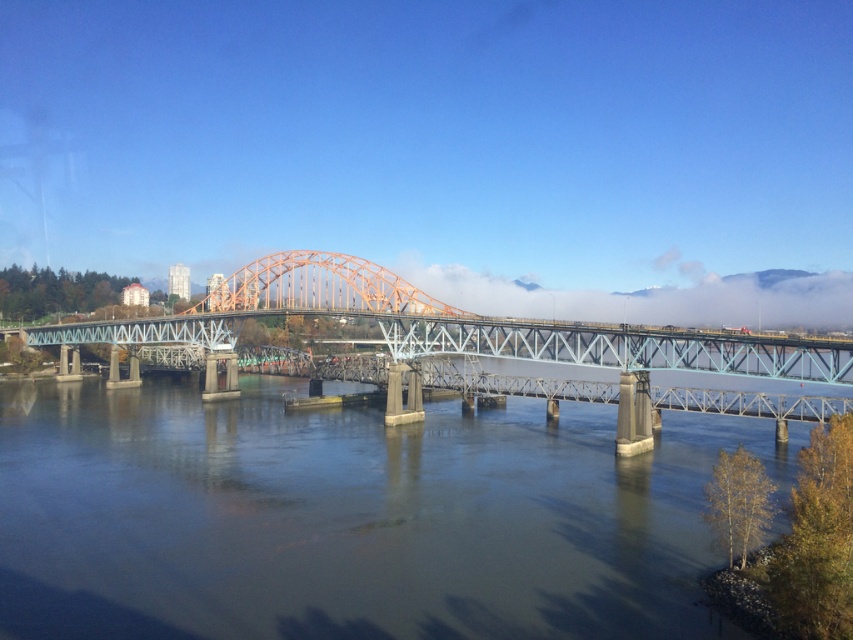
Question: Which of the following is the closest to the observer?

Choices:
 (A) orange metallic bridge at center
 (B) smooth concrete river at center

Answer: (B)

Question: In this image, where is smooth concrete river at center located relative to orange metallic bridge at center?

Choices:
 (A) right
 (B) left

Answer: (A)

Question: Does smooth concrete river at center come behind orange metallic bridge at center?

Choices:
 (A) no
 (B) yes

Answer: (A)

Question: Observing the image, what is the correct spatial positioning of smooth concrete river at center in reference to orange metallic bridge at center?

Choices:
 (A) left
 (B) right

Answer: (B)